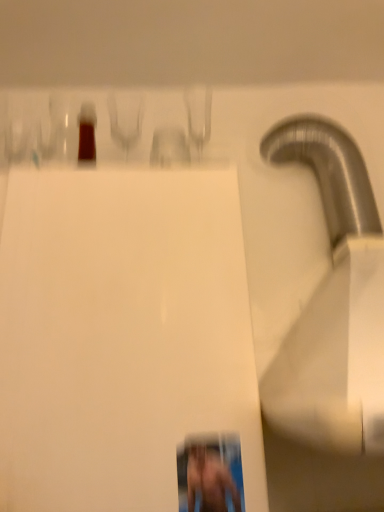
Question: From a real-world perspective, is white glossy paper at center physically located above or below smooth skin person at lower right?

Choices:
 (A) below
 (B) above

Answer: (B)

Question: Is white glossy paper at center bigger or smaller than smooth skin person at lower right?

Choices:
 (A) small
 (B) big

Answer: (B)

Question: Is white glossy paper at center situated inside smooth skin person at lower right or outside?

Choices:
 (A) inside
 (B) outside

Answer: (B)

Question: Would you say smooth skin person at lower right is to the left or to the right of white glossy paper at center in the picture?

Choices:
 (A) left
 (B) right

Answer: (B)

Question: Considering the positions of smooth skin person at lower right and white glossy paper at center in the image, is smooth skin person at lower right wider or thinner than white glossy paper at center?

Choices:
 (A) thin
 (B) wide

Answer: (A)

Question: From a real-world perspective, is smooth skin person at lower right physically located above or below white glossy paper at center?

Choices:
 (A) below
 (B) above

Answer: (A)

Question: In terms of height, does smooth skin person at lower right look taller or shorter compared to white glossy paper at center?

Choices:
 (A) tall
 (B) short

Answer: (B)